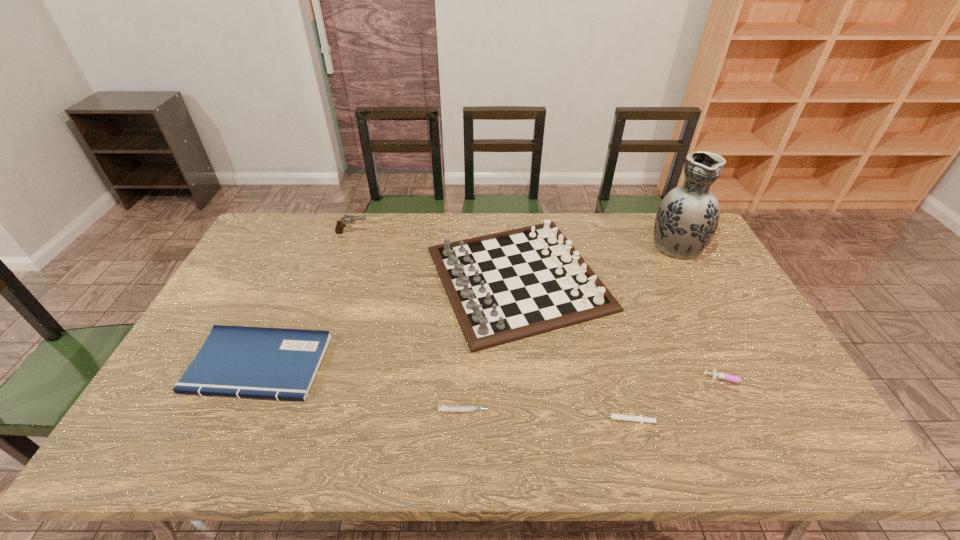
This screenshot has width=960, height=540. Find the location of `object located at the left edge`. object located at the left edge is located at coordinates (235, 361).

I want to click on vase at the right edge, so click(x=687, y=217).

Identify the location of syringe that is positioned at the right edge. This screenshot has width=960, height=540. (716, 374).

Where is `object that is positioned at the far right corner`? object that is positioned at the far right corner is located at coordinates (687, 217).

Where is `vacant space at the far edge of the desktop`? This screenshot has width=960, height=540. vacant space at the far edge of the desktop is located at coordinates (405, 219).

In the image, there is a desktop. Where is `vacant space at the left edge`? The image size is (960, 540). vacant space at the left edge is located at coordinates (266, 273).

The height and width of the screenshot is (540, 960). Find the location of `vacant space at the right edge`. vacant space at the right edge is located at coordinates (757, 366).

At what (x,y) coordinates should I click in order to perform the action: click on vacant region at the far left corner of the desktop. Please return your answer as a coordinate pair (x, y). This screenshot has width=960, height=540. Looking at the image, I should click on (310, 217).

The width and height of the screenshot is (960, 540). In order to click on free spot between the farthest syringe and the paperback book in this screenshot , I will do `click(494, 372)`.

Image resolution: width=960 pixels, height=540 pixels. In order to click on vacant area that lies between the paperback book and the sixth farthest object in this screenshot , I will do `click(361, 388)`.